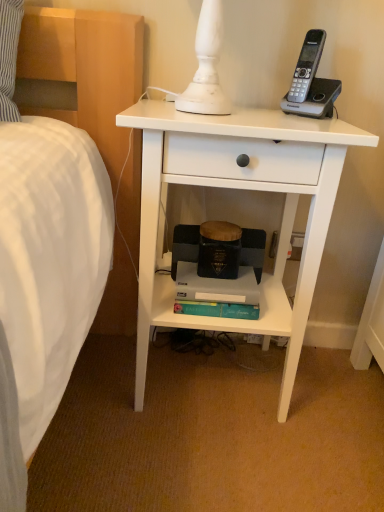
Find the location of a particular element. This screenshot has width=384, height=512. unoccupied region to the right of white matte nightstand at center is located at coordinates pos(337,401).